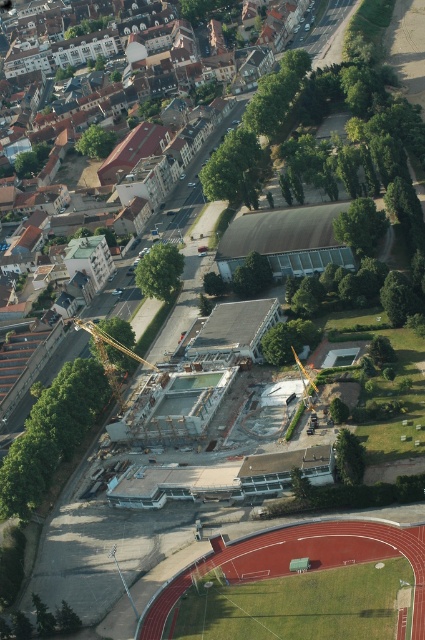
Between green grass football field at lower center and gold metallic crane at center, which one appears on the right side from the viewer's perspective?

Positioned to the right is green grass football field at lower center.

Does point (312, 531) come in front of point (96, 339)?

Yes, it is.

Locate an element on the screen. This screenshot has width=425, height=640. green grass football field at lower center is located at coordinates (297, 556).